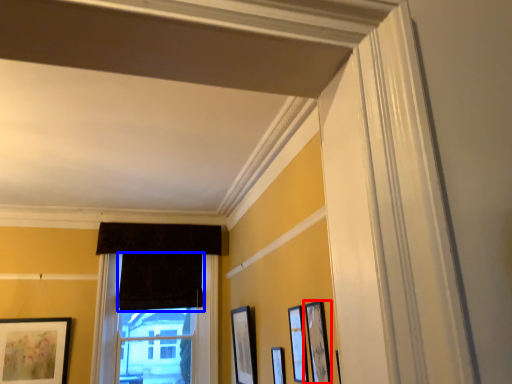
Question: Which object is further to the camera taking this photo, picture frame (highlighted by a red box) or curtain (highlighted by a blue box)?

Choices:
 (A) picture frame
 (B) curtain

Answer: (B)